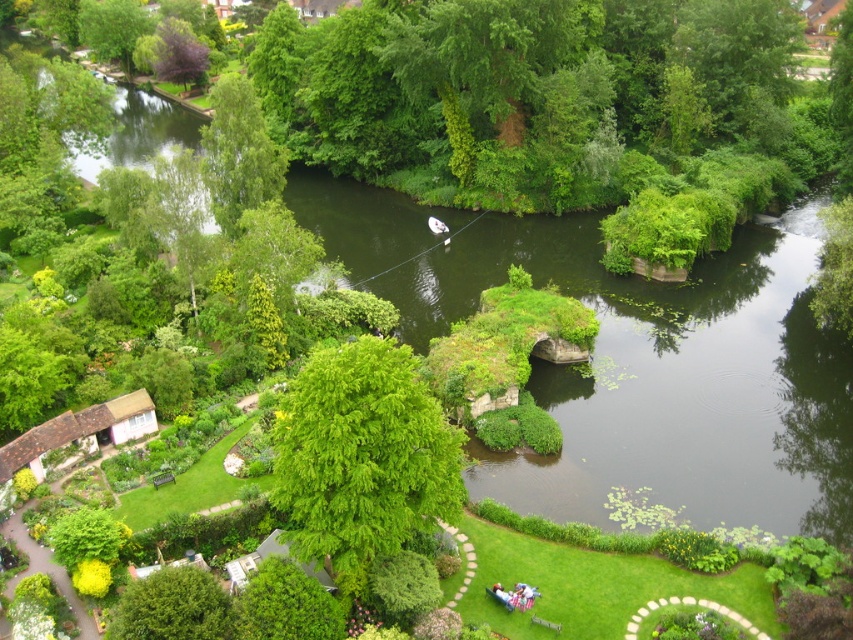
Can you confirm if green leafy tree at center is positioned to the right of green leafy tree at lower left?

Correct, you'll find green leafy tree at center to the right of green leafy tree at lower left.

Between point (340, 576) and point (170, 580), which one is positioned in front?

Point (170, 580) is more forward.

The width and height of the screenshot is (853, 640). I want to click on green leafy tree at center, so click(363, 458).

How far apart are green leafy tree at center and green leafy tree at upper left?

A distance of 35.57 meters exists between green leafy tree at center and green leafy tree at upper left.

Which is behind, point (347, 589) or point (230, 221)?

Positioned behind is point (230, 221).

Between point (343, 400) and point (281, 176), which one is positioned behind?

Point (281, 176)

Find the location of a particular element. The width and height of the screenshot is (853, 640). green leafy tree at center is located at coordinates (363, 458).

Can you confirm if green leafy tree at lower left is positioned to the right of purple leafy tree at upper left?

Indeed, green leafy tree at lower left is positioned on the right side of purple leafy tree at upper left.

Can you confirm if green leafy tree at lower left is positioned below purple leafy tree at upper left?

Yes, green leafy tree at lower left is below purple leafy tree at upper left.

Between point (146, 608) and point (170, 54), which one is positioned in front?

Point (146, 608)

Find the location of `green leafy tree at lower left`. green leafy tree at lower left is located at coordinates (172, 608).